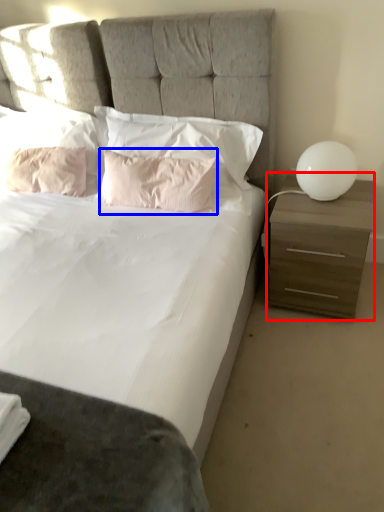
Question: Which point is closer to the camera, nightstand (highlighted by a red box) or pillow (highlighted by a blue box)?

Choices:
 (A) nightstand
 (B) pillow

Answer: (A)